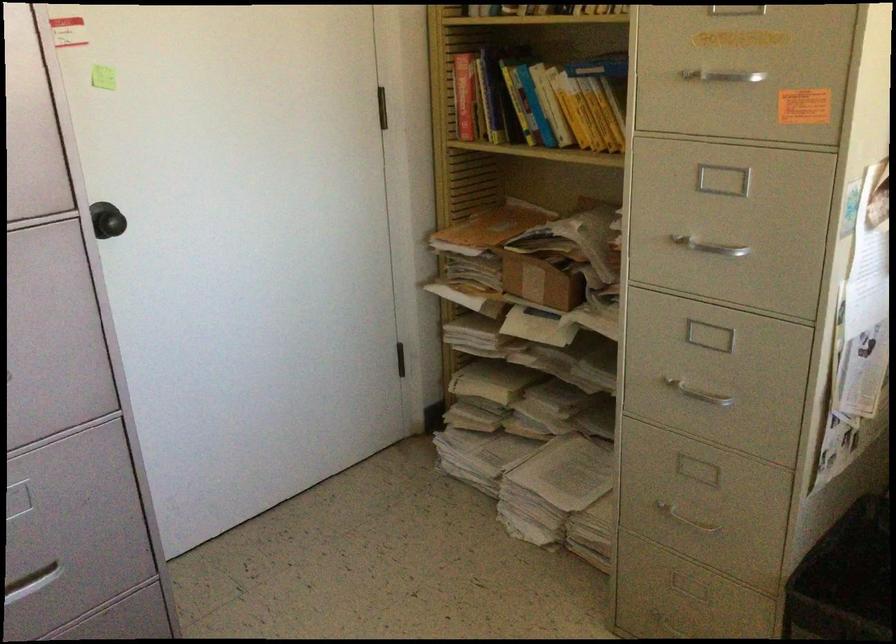
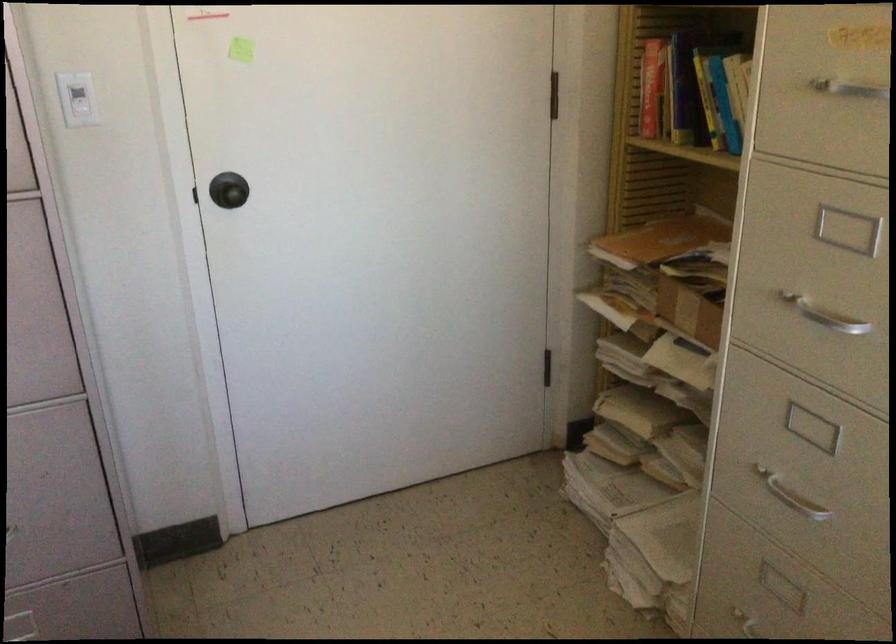
Find the pixel in the second image that matches (x=701, y=68) in the first image.

(839, 82)